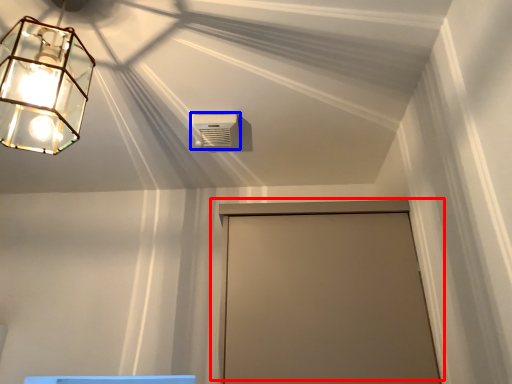
Question: Which object appears farthest to the camera in this image, door (highlighted by a red box) or air conditioning (highlighted by a blue box)?

Choices:
 (A) door
 (B) air conditioning

Answer: (B)